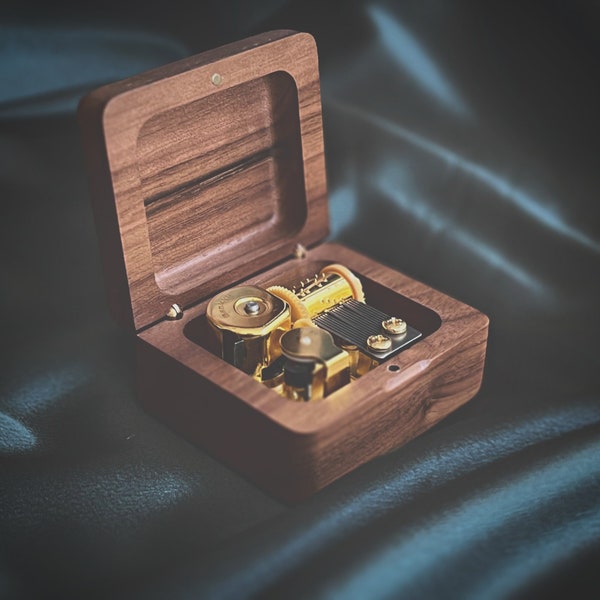
The width and height of the screenshot is (600, 600). Find the location of `gold screw`. gold screw is located at coordinates (396, 324).